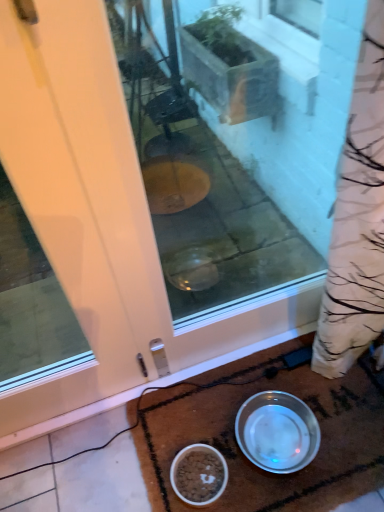
This screenshot has height=512, width=384. In order to click on vacant area to the right of white glossy bowl at lower center, which is the 1th bowl in left-to-right order in this screenshot , I will do coord(258,487).